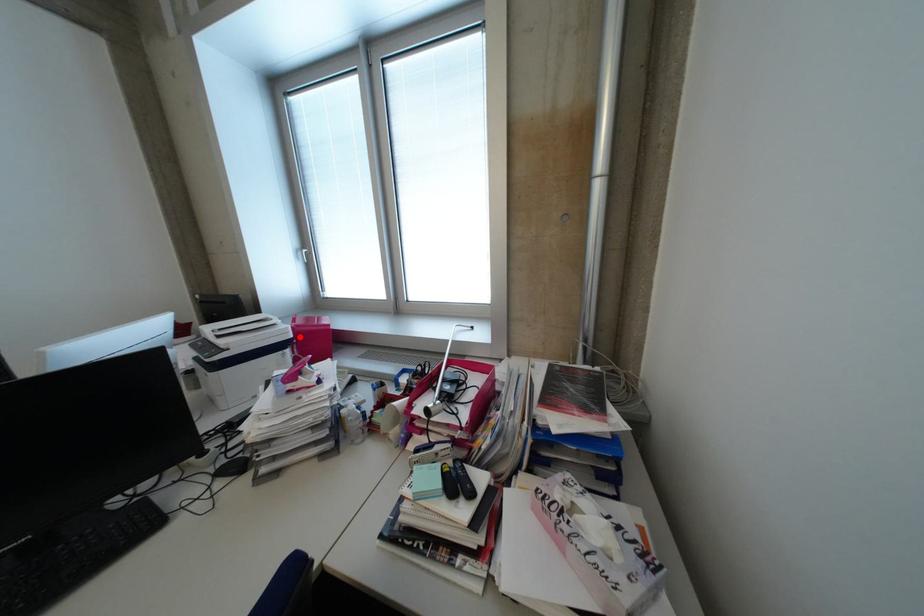
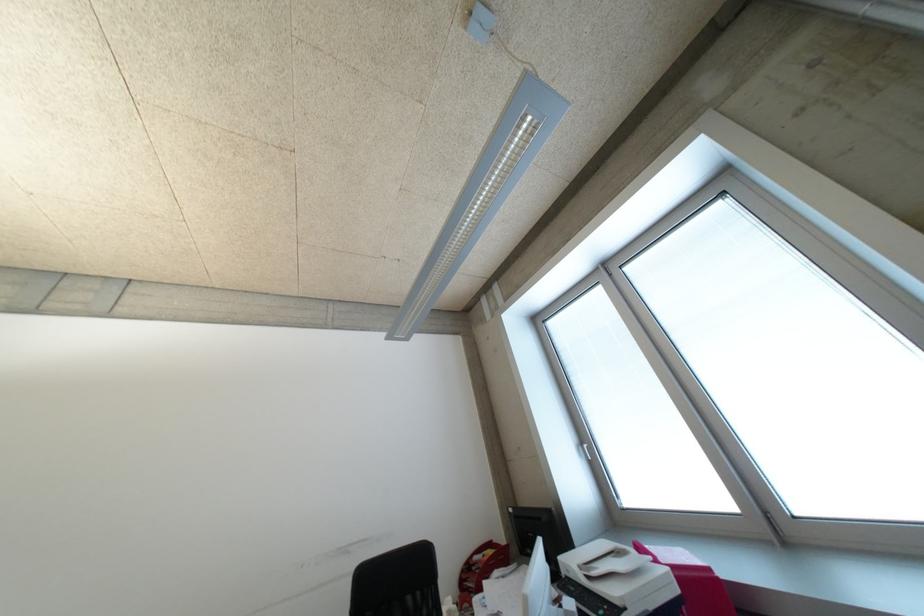
The point at the highlighted location is marked in the first image. Where is the corresponding point in the second image?

(687, 591)